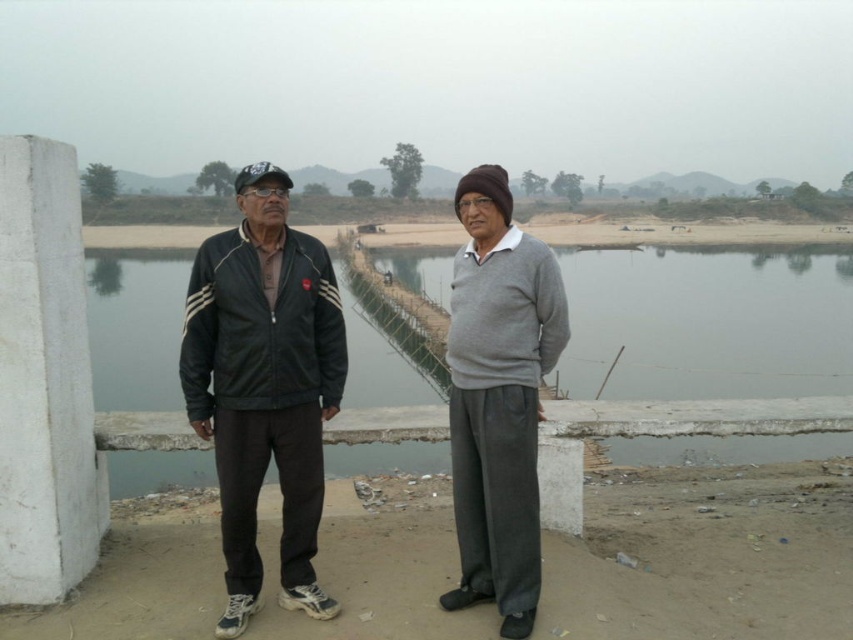
Question: Which object appears farthest from the camera in this image?

Choices:
 (A) black leather jacket at left
 (B) gray wool sweater at center

Answer: (A)

Question: Which object is positioned farthest from the black leather jacket at left?

Choices:
 (A) gray concrete river at center
 (B) black leather jacket at center
 (C) gray wool sweater at center

Answer: (A)

Question: Considering the relative positions of black leather jacket at center and black leather jacket at left in the image provided, where is black leather jacket at center located with respect to black leather jacket at left?

Choices:
 (A) below
 (B) above

Answer: (B)

Question: Is black leather jacket at left smaller than gray wool sweater at center?

Choices:
 (A) no
 (B) yes

Answer: (A)

Question: Can you confirm if black leather jacket at left is smaller than gray wool sweater at center?

Choices:
 (A) no
 (B) yes

Answer: (A)

Question: Based on their relative distances, which object is nearer to the black leather jacket at left?

Choices:
 (A) gray wool sweater at center
 (B) black leather jacket at center
 (C) gray concrete river at center

Answer: (B)